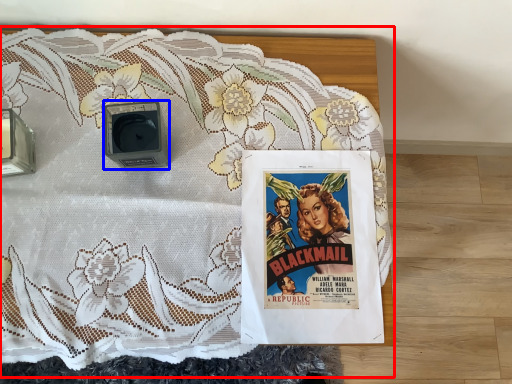
Question: Among these objects, which one is farthest to the camera, bed (highlighted by a red box) or alarm (highlighted by a blue box)?

Choices:
 (A) bed
 (B) alarm

Answer: (B)